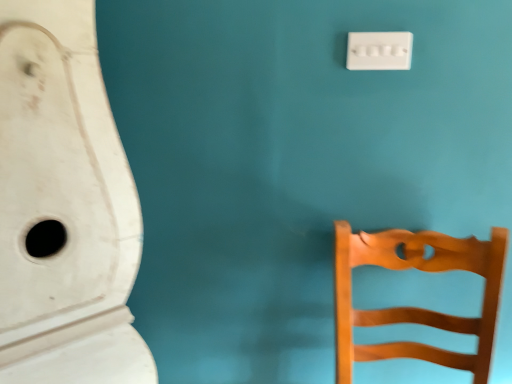
Question: Is wooden chair at right with white matte urinal at left?

Choices:
 (A) no
 (B) yes

Answer: (A)

Question: Does wooden chair at right have a greater width compared to white matte urinal at left?

Choices:
 (A) yes
 (B) no

Answer: (B)

Question: Is wooden chair at right at the left side of white matte urinal at left?

Choices:
 (A) no
 (B) yes

Answer: (A)

Question: Is wooden chair at right closer to the viewer compared to white matte urinal at left?

Choices:
 (A) no
 (B) yes

Answer: (A)

Question: From a real-world perspective, is wooden chair at right positioned under white matte urinal at left based on gravity?

Choices:
 (A) no
 (B) yes

Answer: (B)

Question: Would you say wooden chair at right is a long distance from white matte urinal at left?

Choices:
 (A) no
 (B) yes

Answer: (A)

Question: From a real-world perspective, is white matte urinal at left located beneath white plastic light switch at upper right?

Choices:
 (A) no
 (B) yes

Answer: (B)

Question: Considering the relative sizes of white matte urinal at left and white plastic light switch at upper right in the image provided, is white matte urinal at left taller than white plastic light switch at upper right?

Choices:
 (A) no
 (B) yes

Answer: (B)

Question: From the image's perspective, would you say white matte urinal at left is shown under white plastic light switch at upper right?

Choices:
 (A) yes
 (B) no

Answer: (A)

Question: Considering the relative sizes of white matte urinal at left and white plastic light switch at upper right in the image provided, is white matte urinal at left smaller than white plastic light switch at upper right?

Choices:
 (A) no
 (B) yes

Answer: (A)

Question: Is white matte urinal at left positioned in front of white plastic light switch at upper right?

Choices:
 (A) no
 (B) yes

Answer: (B)

Question: Is white matte urinal at left to the right of white plastic light switch at upper right from the viewer's perspective?

Choices:
 (A) no
 (B) yes

Answer: (A)

Question: Is white plastic light switch at upper right at the left side of wooden chair at right?

Choices:
 (A) no
 (B) yes

Answer: (B)